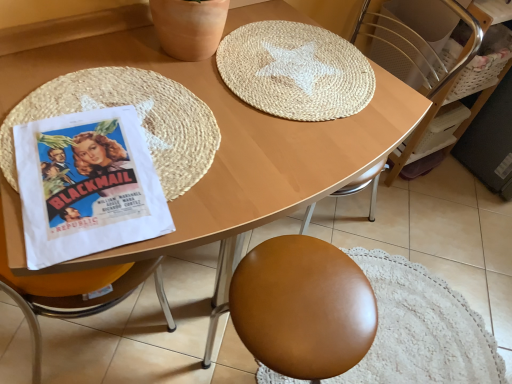
At what (x,y) coordinates should I click in order to perform the action: click on empty space that is ontop of white paper poster at left (from a real-world perspective). Please return your answer as a coordinate pair (x, y). This screenshot has height=384, width=512. Looking at the image, I should click on coord(92,175).